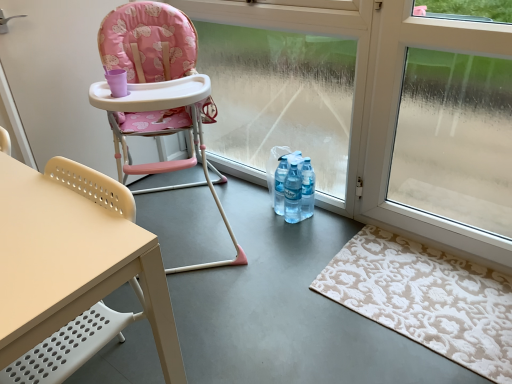
Question: From a real-world perspective, is pink fabric highchair at left, the 1th chair when ordered from back to front, positioned above or below beige plastic chair at left, marked as the 1th chair in a front-to-back arrangement?

Choices:
 (A) above
 (B) below

Answer: (A)

Question: Considering the positions of pink fabric highchair at left, marked as the 2th chair in a front-to-back arrangement, and beige plastic chair at left, which is the second chair in back-to-front order, in the image, is pink fabric highchair at left, marked as the 2th chair in a front-to-back arrangement, taller or shorter than beige plastic chair at left, which is the second chair in back-to-front order,?

Choices:
 (A) short
 (B) tall

Answer: (B)

Question: Based on their relative distances, which object is farther from the transparent glass window at lower right?

Choices:
 (A) pink fabric highchair at left, marked as the 2th chair in a front-to-back arrangement
 (B) transparent glass window at center
 (C) beige plastic chair at left, which is the second chair in back-to-front order
 (D) translucent plastic bottles at center
 (E) beige textured rug at lower right

Answer: (C)

Question: Based on their relative distances, which object is nearer to the beige textured rug at lower right?

Choices:
 (A) pink fabric highchair at left, marked as the 2th chair in a front-to-back arrangement
 (B) transparent glass window at center
 (C) translucent plastic bottles at center
 (D) transparent glass window at lower right
 (E) beige plastic chair at left, marked as the 1th chair in a front-to-back arrangement

Answer: (D)